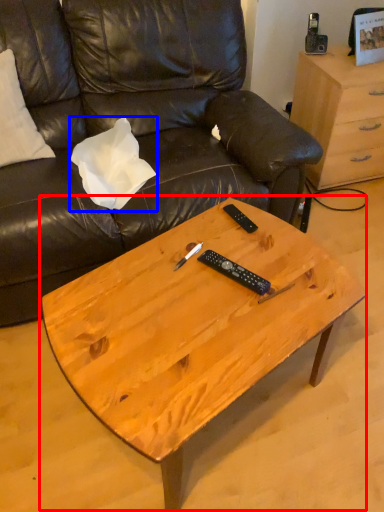
Question: Among these objects, which one is farthest to the camera, coffee table (highlighted by a red box) or pillow (highlighted by a blue box)?

Choices:
 (A) coffee table
 (B) pillow

Answer: (B)